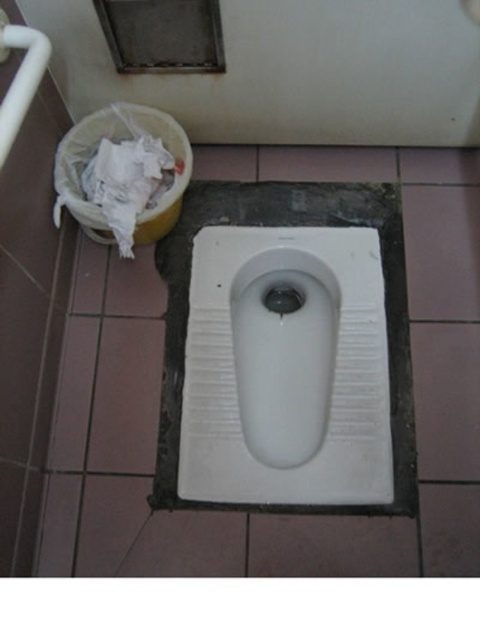
Question: Which point is closer to the camera taking this photo?

Choices:
 (A) (132, 218)
 (B) (348, 448)

Answer: (A)

Question: Does white ceramic urinal at center appear over white crumpled paper at upper left?

Choices:
 (A) yes
 (B) no

Answer: (B)

Question: Does white ceramic urinal at center have a larger size compared to white crumpled paper at upper left?

Choices:
 (A) no
 (B) yes

Answer: (B)

Question: Which point is closer to the camera?

Choices:
 (A) (113, 189)
 (B) (291, 237)

Answer: (A)

Question: Is the position of white ceramic urinal at center more distant than that of white crumpled paper at upper left?

Choices:
 (A) yes
 (B) no

Answer: (A)